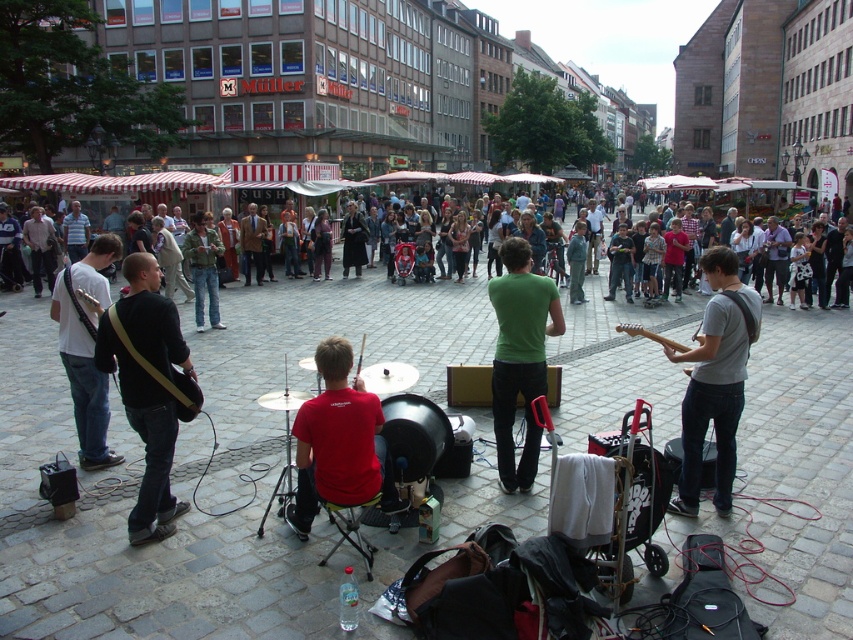
Does black leather guitar at left have a lesser width compared to multicolored casual clothing at center?

Yes, black leather guitar at left is thinner than multicolored casual clothing at center.

This screenshot has width=853, height=640. Describe the element at coordinates (146, 387) in the screenshot. I see `black leather guitar at left` at that location.

Is point (148, 515) farther from camera compared to point (134, 189)?

No, it is not.

I want to click on black leather guitar at left, so click(x=146, y=387).

Is point (708, 397) in front of point (201, 180)?

Yes, point (708, 397) is closer to viewer.

This screenshot has width=853, height=640. What do you see at coordinates (715, 380) in the screenshot?
I see `gray fabric guitar at center` at bounding box center [715, 380].

Identify the location of gray fabric guitar at center. The width and height of the screenshot is (853, 640). (715, 380).

How distant is gray fabric guitar at center from matte black guitar at left?

The distance of gray fabric guitar at center from matte black guitar at left is 5.37 meters.

Is gray fabric guitar at center to the left of matte black guitar at left from the viewer's perspective?

Incorrect, gray fabric guitar at center is not on the left side of matte black guitar at left.

Is point (693, 504) more distant than point (70, 380)?

No, it is not.

At what (x,y) coordinates should I click in order to perform the action: click on gray fabric guitar at center. Please return your answer as a coordinate pair (x, y). This screenshot has width=853, height=640. Looking at the image, I should click on (715, 380).